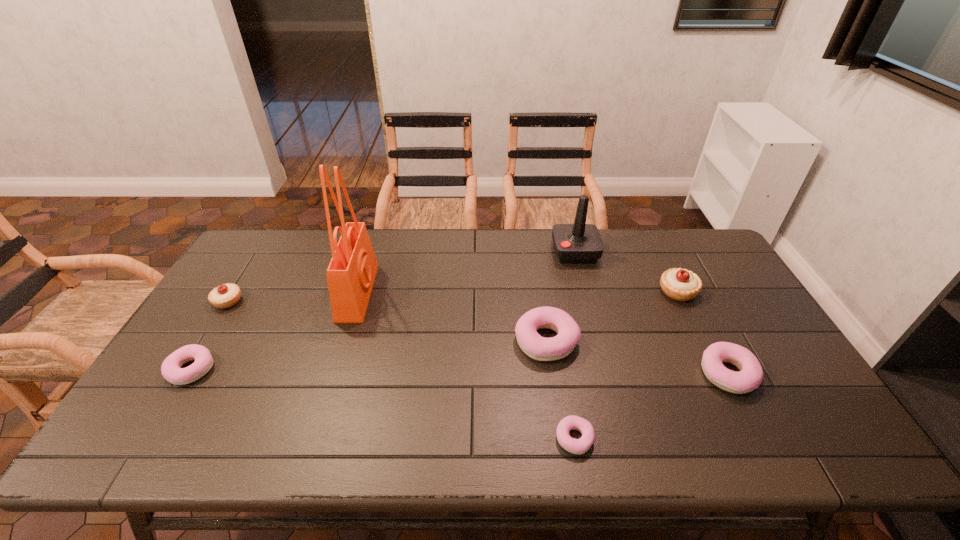
Identify the location of the second shortest object. (171, 370).

At what (x,y) coordinates should I click in order to perform the action: click on the nearest pastry. Please return your answer as a coordinate pair (x, y). Looking at the image, I should click on (576, 446).

Locate an element on the screen. The height and width of the screenshot is (540, 960). the shortest object is located at coordinates (576, 446).

Locate an element on the screen. free location located 0.270m on the logo side of the sixth object from right to left is located at coordinates (459, 292).

Identify the location of vacant space situated on the front of the joystick. (588, 299).

Identify the location of vacant space situated on the front of the right beige pastry. The image size is (960, 540). (708, 354).

Locate an element on the screen. This screenshot has height=540, width=960. vacant area situated on the back of the smaller beige pastry is located at coordinates (249, 267).

This screenshot has width=960, height=540. I want to click on free space located 0.300m on the right of the biggest pink pastry, so click(685, 340).

I want to click on vacant space located 0.320m on the left of the rightmost pink pastry, so click(577, 374).

The width and height of the screenshot is (960, 540). Identify the location of vacant space situated 0.120m on the back of the second shortest pastry. (221, 320).